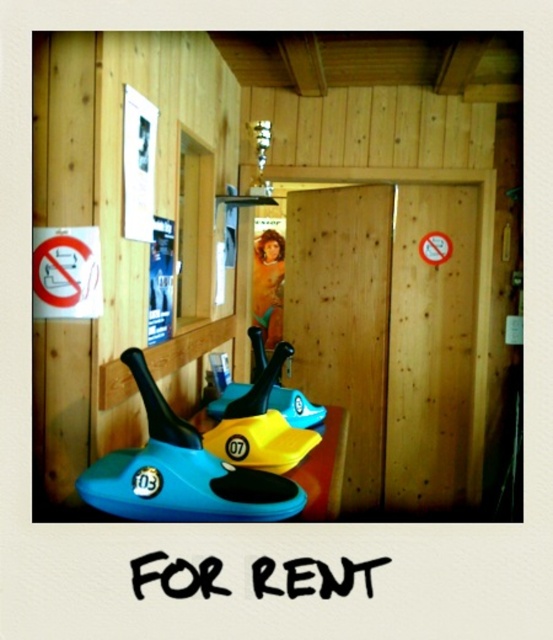
Question: Is the position of blue plastic snowboard at lower left less distant than that of blue rubber toy at center?

Choices:
 (A) no
 (B) yes

Answer: (A)

Question: Which of the following is the closest to the observer?

Choices:
 (A) blue rubber toy at center
 (B) blue plastic snowboard at lower left

Answer: (A)

Question: Can you confirm if blue plastic snowboard at lower left is bigger than blue rubber toy at center?

Choices:
 (A) yes
 (B) no

Answer: (A)

Question: Is blue plastic snowboard at lower left thinner than blue rubber toy at center?

Choices:
 (A) yes
 (B) no

Answer: (B)

Question: Which object appears closest to the camera in this image?

Choices:
 (A) blue rubber toy at center
 (B) blue plastic snowboard at lower left

Answer: (A)